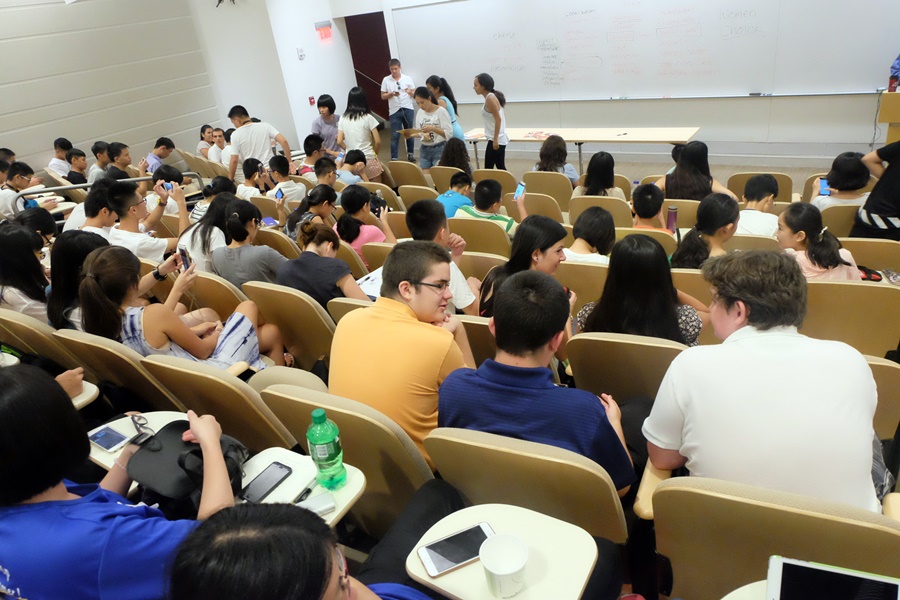
What are the coordinates of `student table` in the screenshot? It's located at (744, 593), (582, 557), (351, 487), (156, 415), (93, 387), (12, 356).